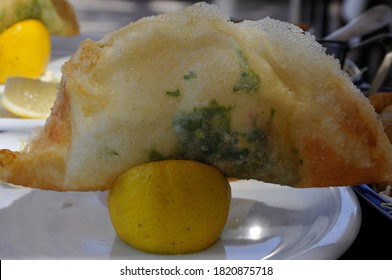
This screenshot has width=392, height=280. Identify the location of blue plate edge. (368, 196).